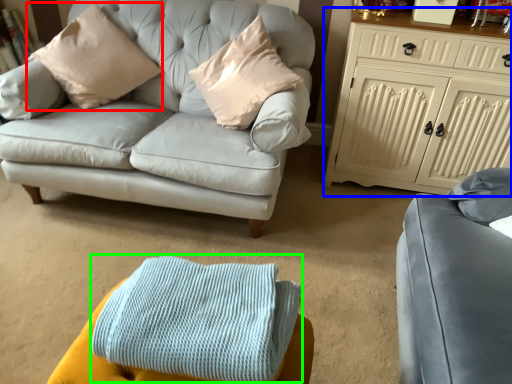
Question: Which object is the closest to the pillow (highlighted by a red box)? Choose among these: cabinetry (highlighted by a blue box) or blanket (highlighted by a green box).

Choices:
 (A) cabinetry
 (B) blanket

Answer: (A)